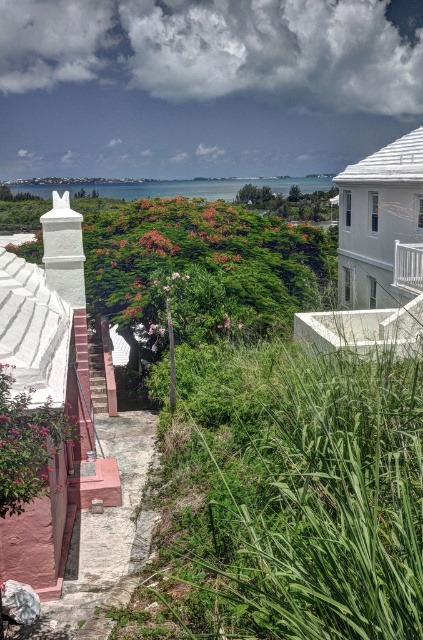
Is white metal railing at upper right smaller than pink painted stairs at lower left?

Yes.

Does white metal railing at upper right appear on the left side of pink painted stairs at lower left?

In fact, white metal railing at upper right is to the right of pink painted stairs at lower left.

Who is more distant from viewer, (422, 285) or (96, 381)?

Point (96, 381)

You are a GUI agent. You are given a task and a screenshot of the screen. Output one action in this format:
    pyautogui.click(x=<x>, y=<y>)
    Task: Click on the white metal railing at upper right
    
    Given the screenshot: What is the action you would take?
    pyautogui.click(x=408, y=266)

Who is positioned more to the right, pink concrete path at lower left or blue water at center?

pink concrete path at lower left

Is point (136, 499) closer to camera compared to point (137, 195)?

Yes, it is in front of point (137, 195).

The image size is (423, 640). In order to click on pink concrete path at lower left in this screenshot , I will do `click(102, 532)`.

Is blue water at center below white metal railing at upper right?

Actually, blue water at center is above white metal railing at upper right.

Who is positioned more to the left, blue water at center or white metal railing at upper right?

blue water at center is more to the left.

Who is more distant from viewer, (35, 188) or (420, 280)?

Positioned behind is point (35, 188).

The height and width of the screenshot is (640, 423). What are the coordinates of `blue water at center` in the screenshot? It's located at (181, 188).